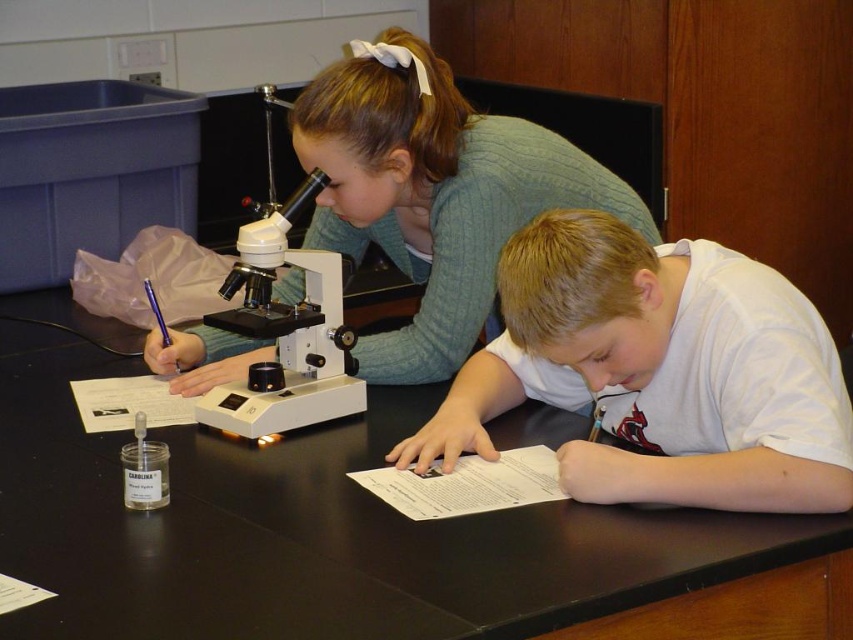
Question: Is white matte shirt at center smaller than green sweater at upper center?

Choices:
 (A) yes
 (B) no

Answer: (A)

Question: Which is nearer to the white plastic microscope at center?

Choices:
 (A) white matte shirt at center
 (B) green sweater at upper center

Answer: (B)

Question: Among these points, which one is farthest from the camera?

Choices:
 (A) (467, 120)
 (B) (819, 458)

Answer: (A)

Question: Is white matte shirt at center closer to camera compared to green sweater at upper center?

Choices:
 (A) no
 (B) yes

Answer: (B)

Question: Which of the following is the closest to the observer?

Choices:
 (A) white matte shirt at center
 (B) white plastic microscope at center
 (C) green sweater at upper center

Answer: (A)

Question: In this image, where is green sweater at upper center located relative to white plastic microscope at center?

Choices:
 (A) left
 (B) right

Answer: (B)